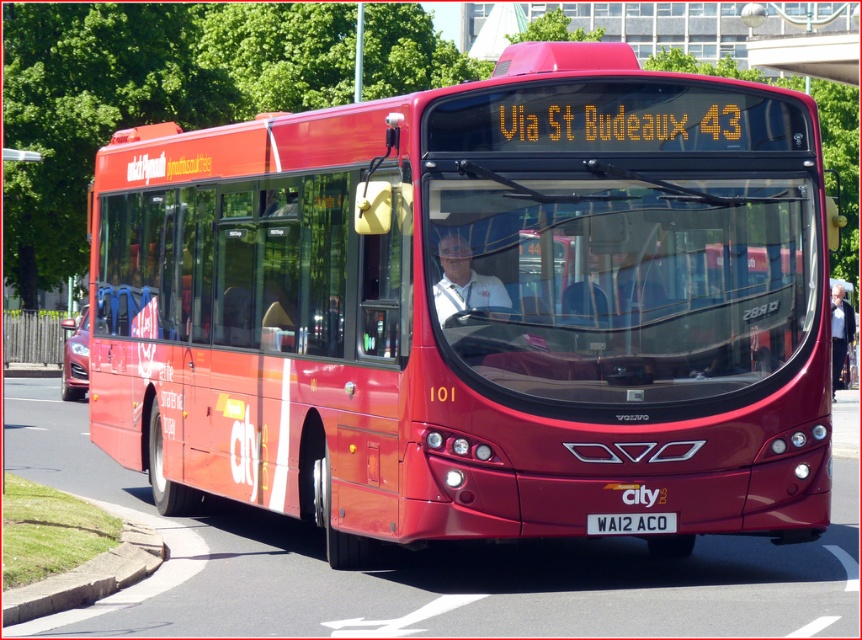
Can you confirm if matte red bus at center is thinner than white plastic license plate at center?

Yes, matte red bus at center is thinner than white plastic license plate at center.

Where is `matte red bus at center`? matte red bus at center is located at coordinates (475, 308).

You are a GUI agent. You are given a task and a screenshot of the screen. Output one action in this format:
    pyautogui.click(x=<x>, y=<y>)
    Task: Click on the matte red bus at center
    
    Given the screenshot: What is the action you would take?
    [x=475, y=308]

Which is behind, point (492, 308) or point (608, 518)?

The point (608, 518) is behind.

Does white shirt at center have a larger size compared to white plastic license plate at center?

Indeed, white shirt at center has a larger size compared to white plastic license plate at center.

Locate an element on the screen. Image resolution: width=862 pixels, height=640 pixels. white shirt at center is located at coordinates (464, 282).

How far apart are matte red bus at center and white fabric jacket at center?

The distance of matte red bus at center from white fabric jacket at center is 12.88 meters.

Between matte red bus at center and white fabric jacket at center, which one appears on the left side from the viewer's perspective?

matte red bus at center

Is point (394, 344) farther from camera compared to point (834, 301)?

That is False.

Where is `matte red bus at center`? matte red bus at center is located at coordinates (475, 308).